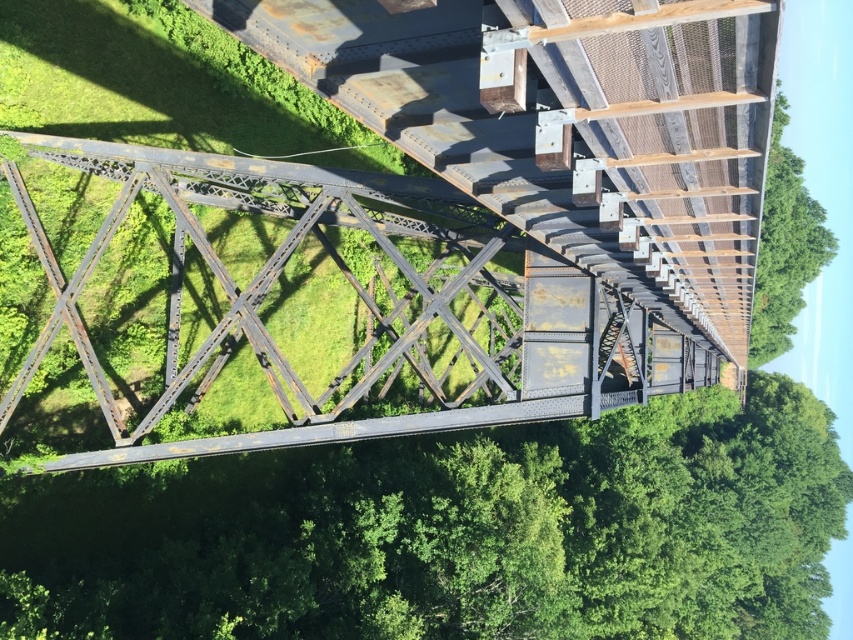
You are standing on a metal truss bridge and want to know how far the point at coordinates (286,428) is from you. Can you determine the distance?

The point at coordinates (286,428) is 20.26 meters away from the viewer.

You are a photographer planning to capture the green leafy tree at center and the rusty metal bridge at center in a single frame. Based on their sizes, which object will occupy more of the photo?

The green leafy tree at center is larger in size than the rusty metal bridge at center, so it will occupy more space in the photo.